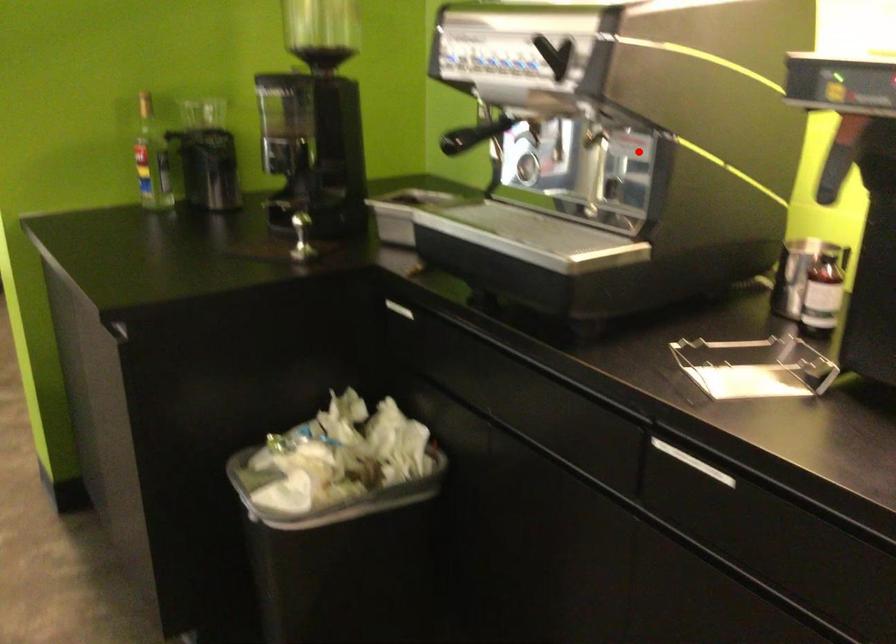
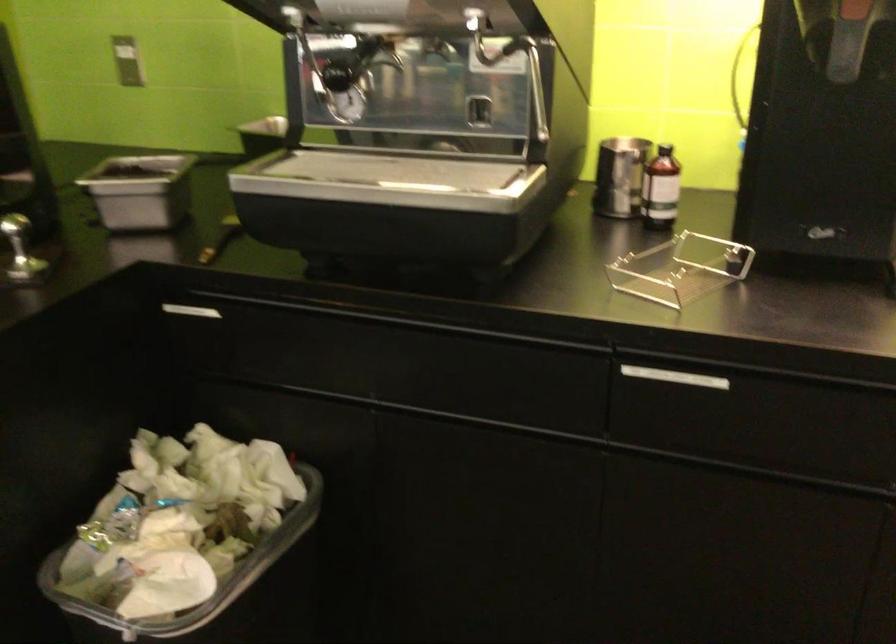
Question: I am providing you with two images of the same scene from different viewpoints. A red point is shown in image1. For the corresponding object point in image2, is it positioned nearer or farther from the camera?

Choices:
 (A) Nearer
 (B) Farther

Answer: (A)